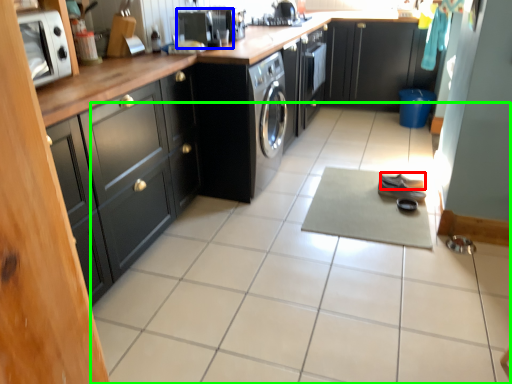
Question: Estimate the real-world distances between objects in this image. Which object is closer to shoe (highlighted by a red box), appliance (highlighted by a blue box) or ceramic tile (highlighted by a green box)?

Choices:
 (A) appliance
 (B) ceramic tile

Answer: (B)